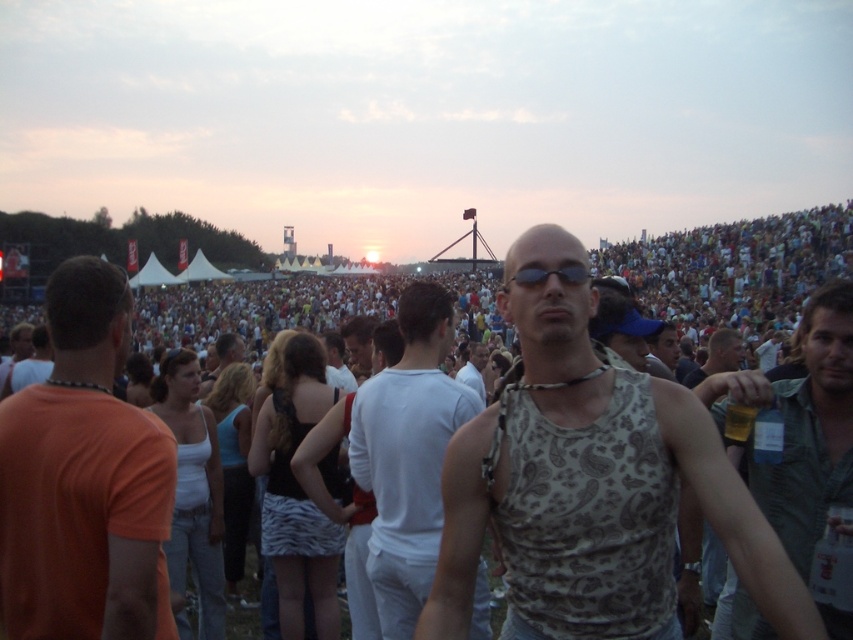
You are standing at the festival and see two points marked in the image. Which point is closer to you, point (770,602) or point (724,339)?

Point (770,602) is in front of point (724,339), so it is closer to you.